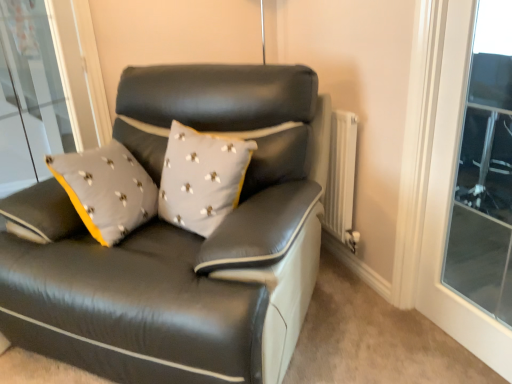
Question: Is transparent glass window at upper right facing towards white textured radiator at right?

Choices:
 (A) no
 (B) yes

Answer: (A)

Question: Can you confirm if transparent glass window at upper right is wider than white textured radiator at right?

Choices:
 (A) yes
 (B) no

Answer: (B)

Question: Is transparent glass window at upper right far away from white textured radiator at right?

Choices:
 (A) yes
 (B) no

Answer: (A)

Question: Is transparent glass window at upper right closer to camera compared to white textured radiator at right?

Choices:
 (A) no
 (B) yes

Answer: (B)

Question: Is white textured radiator at right inside transparent glass window at upper right?

Choices:
 (A) yes
 (B) no

Answer: (B)

Question: From a real-world perspective, is transparent glass window at upper right physically below white textured radiator at right?

Choices:
 (A) no
 (B) yes

Answer: (A)

Question: Could transparent glass window at upper right be considered to be inside white textured radiator at right?

Choices:
 (A) yes
 (B) no

Answer: (B)

Question: Considering the relative sizes of white textured radiator at right and transparent glass window at upper right in the image provided, is white textured radiator at right bigger than transparent glass window at upper right?

Choices:
 (A) no
 (B) yes

Answer: (B)

Question: Can you confirm if white textured radiator at right is wider than transparent glass window at upper right?

Choices:
 (A) no
 (B) yes

Answer: (B)

Question: Is white textured radiator at right positioned with its back to transparent glass window at upper right?

Choices:
 (A) no
 (B) yes

Answer: (A)

Question: From the image's perspective, is white textured radiator at right below transparent glass window at upper right?

Choices:
 (A) yes
 (B) no

Answer: (B)

Question: From a real-world perspective, is white textured radiator at right under transparent glass window at upper right?

Choices:
 (A) no
 (B) yes

Answer: (B)

Question: From the image's perspective, would you say matte black leather couch at center is shown under transparent glass window at upper right?

Choices:
 (A) no
 (B) yes

Answer: (B)